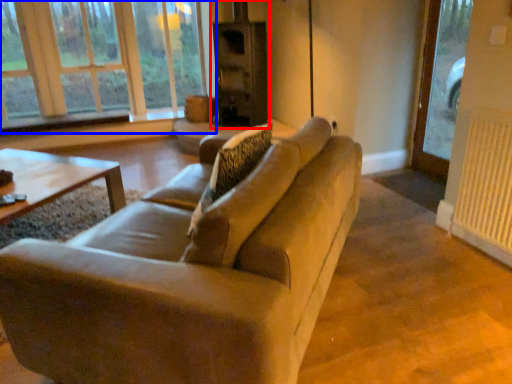
Question: Which of the following is the closest to the observer, fireplace (highlighted by a red box) or window (highlighted by a blue box)?

Choices:
 (A) fireplace
 (B) window

Answer: (A)